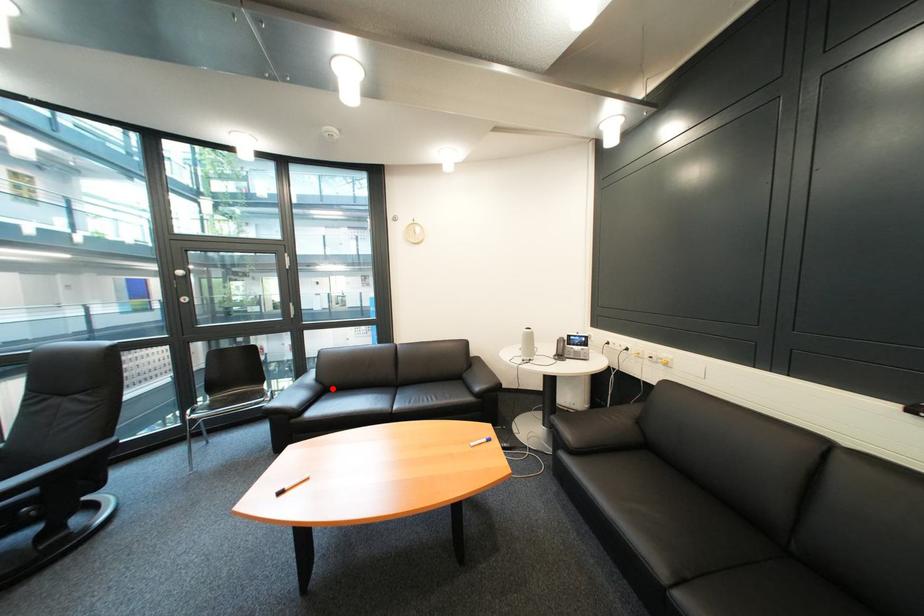
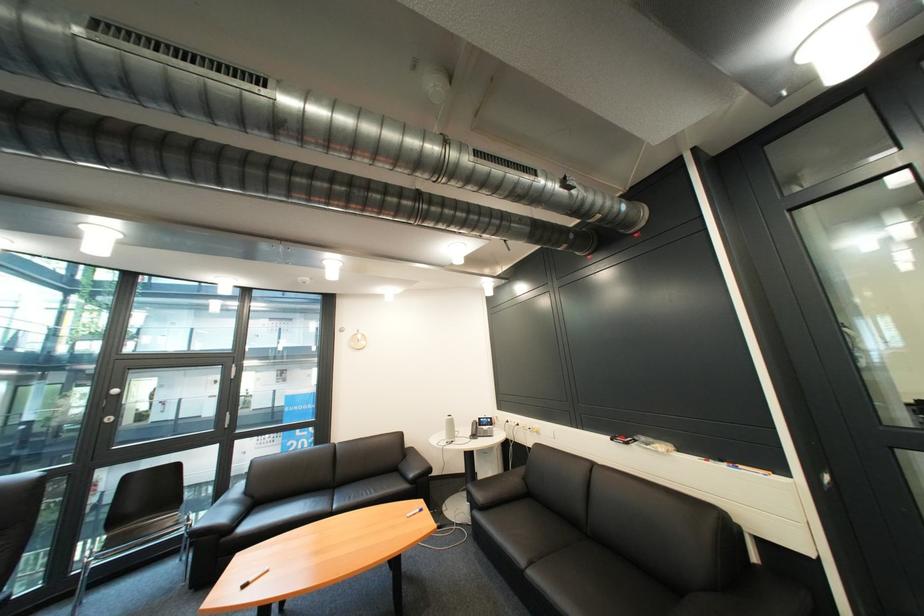
Where in the second image is the point corresponding to the highlighted location from the first image?

(262, 503)